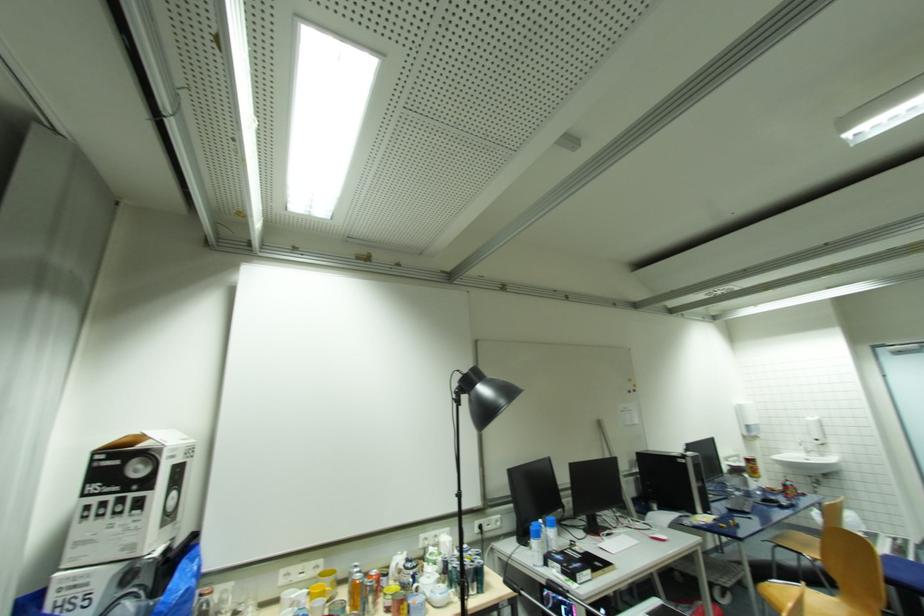
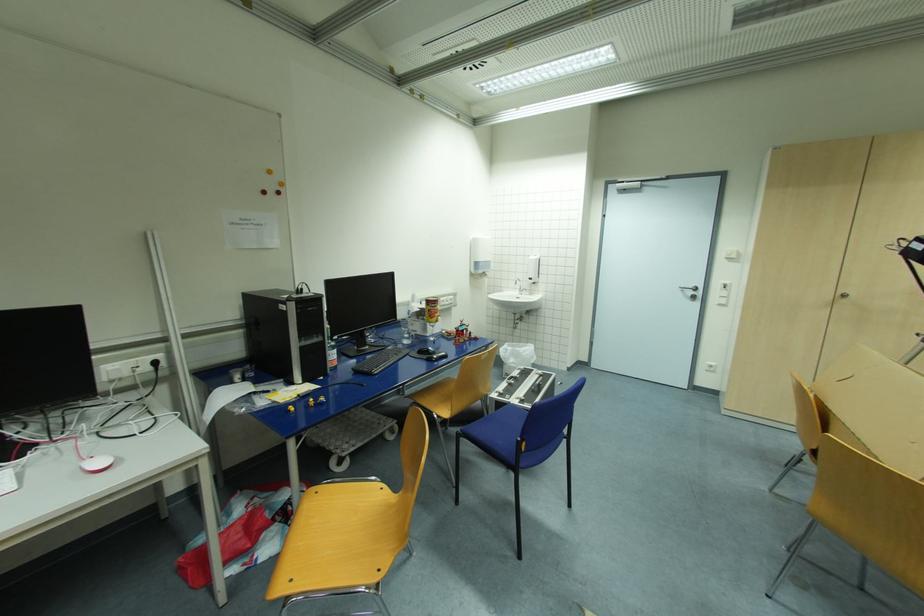
The point at (754, 461) is marked in the first image. Where is the corresponding point in the second image?

(433, 302)